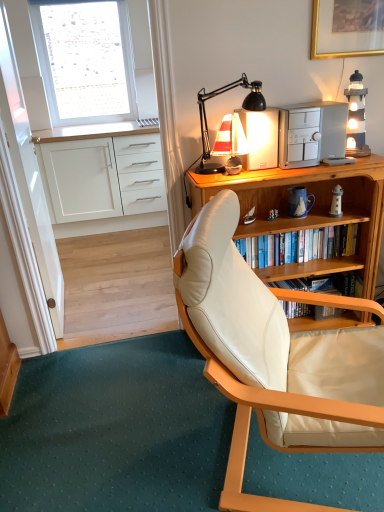
In order to face white matte cabinet at left, should I rotate leftwards or rightwards?

Turn left approximately 9.212 degrees to face it.

Locate an element on the screen. Image resolution: width=384 pixels, height=512 pixels. white matte cabinet at left is located at coordinates (102, 184).

Describe the element at coordinates (300, 245) in the screenshot. This screenshot has width=384, height=512. I see `wooden bookshelf at center` at that location.

Locate an element on the screen. This screenshot has width=384, height=512. white fabric window at upper left is located at coordinates (85, 60).

Locate an element on the screen. This screenshot has height=512, width=384. white plastic phone at upper right is located at coordinates (338, 161).

Is black matte desk lamp at upper right, which is the 2th lamp in right-to-left order, taller than white plastic phone at upper right?

Yes, black matte desk lamp at upper right, which is the 2th lamp in right-to-left order, is taller than white plastic phone at upper right.

Is black matte desk lamp at upper right, placed as the 1th lamp when sorted from left to right, not near white plastic phone at upper right?

black matte desk lamp at upper right, placed as the 1th lamp when sorted from left to right, is actually quite close to white plastic phone at upper right.

Can you confirm if black matte desk lamp at upper right, which is the 2th lamp in right-to-left order, is thinner than white plastic phone at upper right?

No, black matte desk lamp at upper right, which is the 2th lamp in right-to-left order, is not thinner than white plastic phone at upper right.

Considering the relative sizes of black matte desk lamp at upper right, which is the 2th lamp in right-to-left order, and white plastic phone at upper right in the image provided, is black matte desk lamp at upper right, which is the 2th lamp in right-to-left order, smaller than white plastic phone at upper right?

Incorrect, black matte desk lamp at upper right, which is the 2th lamp in right-to-left order, is not smaller in size than white plastic phone at upper right.

Based on the photo, is transparent glass door at left to the right of wooden bookshelf at center from the viewer's perspective?

In fact, transparent glass door at left is to the left of wooden bookshelf at center.

From a real-world perspective, does transparent glass door at left stand above wooden bookshelf at center?

Yes, from a real-world perspective, transparent glass door at left is on top of wooden bookshelf at center.

Is point (14, 73) less distant than point (345, 241)?

No, (14, 73) is behind (345, 241).

Is gold-framed picture at upper right wider than wooden bookshelf at center?

In fact, gold-framed picture at upper right might be narrower than wooden bookshelf at center.

Is gold-framed picture at upper right spatially inside wooden bookshelf at center, or outside of it?

gold-framed picture at upper right lies outside wooden bookshelf at center.

From the image's perspective, which object appears higher, gold-framed picture at upper right or wooden bookshelf at center?

From the image's view, gold-framed picture at upper right is above.

The width and height of the screenshot is (384, 512). What are the coordinates of `shelf below the gold-framed picture at upper right (from a real-world perspective)` in the screenshot? It's located at (300, 245).

Which is more to the right, transparent glass door at left or gold-framed picture at upper right?

Positioned to the right is gold-framed picture at upper right.

Is transparent glass door at left aimed at gold-framed picture at upper right?

Yes, transparent glass door at left is facing gold-framed picture at upper right.

Locate an element on the screen. glass door that appears on the left of gold-framed picture at upper right is located at coordinates 29,176.

Between sailboat-patterned ceramic mug at upper right and wooden lighthouse at upper right, acting as the first lamp starting from the right, which one has larger size?

With larger size is wooden lighthouse at upper right, acting as the first lamp starting from the right.

Which is in front, sailboat-patterned ceramic mug at upper right or wooden lighthouse at upper right, acting as the first lamp starting from the right?

wooden lighthouse at upper right, acting as the first lamp starting from the right, is in front.

Is sailboat-patterned ceramic mug at upper right wider than wooden lighthouse at upper right, the second lamp in the left-to-right sequence?

No.

From the image's perspective, is gold-framed picture at upper right positioned above or below white matte cabinet at left?

gold-framed picture at upper right is above white matte cabinet at left.

In the scene shown: Are gold-framed picture at upper right and white matte cabinet at left far apart?

Absolutely, gold-framed picture at upper right is distant from white matte cabinet at left.

Can you confirm if gold-framed picture at upper right is taller than white matte cabinet at left?

Incorrect, the height of gold-framed picture at upper right is not larger of that of white matte cabinet at left.

Which point is more forward, (222, 87) or (10, 118)?

Point (222, 87)

Is black matte desk lamp at upper right, placed as the 1th lamp when sorted from left to right, oriented away from transparent glass door at left?

black matte desk lamp at upper right, placed as the 1th lamp when sorted from left to right, is not turned away from transparent glass door at left.

Considering the positions of objects black matte desk lamp at upper right, placed as the 1th lamp when sorted from left to right, and transparent glass door at left in the image provided, who is more to the left, black matte desk lamp at upper right, placed as the 1th lamp when sorted from left to right, or transparent glass door at left?

transparent glass door at left.

How different are the orientations of black matte desk lamp at upper right, which is the 2th lamp in right-to-left order, and transparent glass door at left in degrees?

They differ by 90.3 degrees in their facing directions.

You are a GUI agent. You are given a task and a screenshot of the screen. Output one action in this format:
    pyautogui.click(x=<x>, y=<y>)
    Task: Click on the corded phone behind the black matte desk lamp at upper right, placed as the 1th lamp when sorted from left to right
    The width and height of the screenshot is (384, 512).
    Given the screenshot: What is the action you would take?
    pyautogui.click(x=338, y=161)

In the image, there is a transparent glass door at left. Identify the location of shelf below it (from a real-world perspective). This screenshot has height=512, width=384. (300, 245).

From the image, which object appears to be nearer to gold-framed picture at upper right, wooden desk at center or white plastic phone at upper right?

white plastic phone at upper right is closer to gold-framed picture at upper right.

Estimate the real-world distances between objects in this image. Which object is further from white plastic phone at upper right, wooden bookshelf at center or wooden lighthouse at upper right, the second lamp in the left-to-right sequence?

Based on the image, wooden bookshelf at center appears to be further to white plastic phone at upper right.

Based on their spatial positions, is wooden bookshelf at center or wooden lighthouse at upper right, acting as the first lamp starting from the right, closer to white fabric window at upper left?

wooden bookshelf at center is closer to white fabric window at upper left.

From the picture: When comparing their distances from wooden bookshelf at center, does beige leather chair at center or wooden lighthouse at upper right, acting as the first lamp starting from the right, seem further?

beige leather chair at center is positioned further to the anchor wooden bookshelf at center.

Based on their spatial positions, is wooden desk at center or gold-framed picture at upper right closer to transparent glass door at left?

wooden desk at center.

Based on their spatial positions, is gold-framed picture at upper right or beige leather chair at center further from wooden lighthouse at upper right, the second lamp in the left-to-right sequence?

beige leather chair at center is positioned further to the anchor wooden lighthouse at upper right, the second lamp in the left-to-right sequence.

Which object lies further to the anchor point white matte cabinet at left, wooden bookshelf at center or wooden desk at center?

Among the two, wooden bookshelf at center is located further to white matte cabinet at left.

When comparing their distances from wooden bookshelf at center, does sailboat-patterned ceramic mug at upper right or white plastic phone at upper right seem closer?

sailboat-patterned ceramic mug at upper right.

You are a GUI agent. You are given a task and a screenshot of the screen. Output one action in this format:
    pyautogui.click(x=<x>, y=<y>)
    Task: Click on the lamp located between gold-framed picture at upper right and white matte cabinet at left in the depth direction
    
    Given the screenshot: What is the action you would take?
    pyautogui.click(x=356, y=117)

Image resolution: width=384 pixels, height=512 pixels. I want to click on chair located between transparent glass door at left and sailboat-patterned ceramic mug at upper right in the left-right direction, so click(x=275, y=357).

Locate an element on the screen. The image size is (384, 512). corded phone between beige leather chair at center and wooden bookshelf at center from front to back is located at coordinates (338, 161).

The image size is (384, 512). I want to click on lamp between transparent glass door at left and white plastic phone at upper right, so click(206, 117).